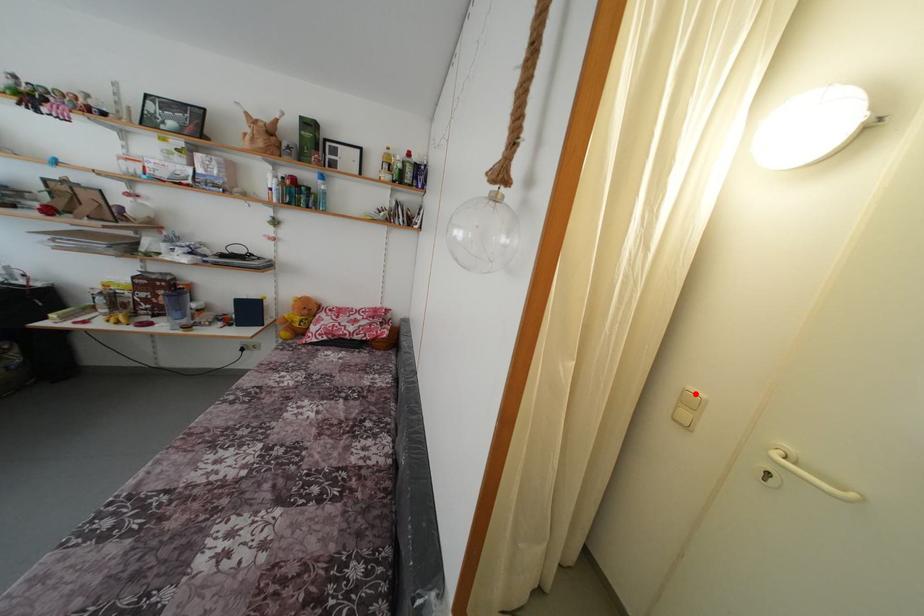
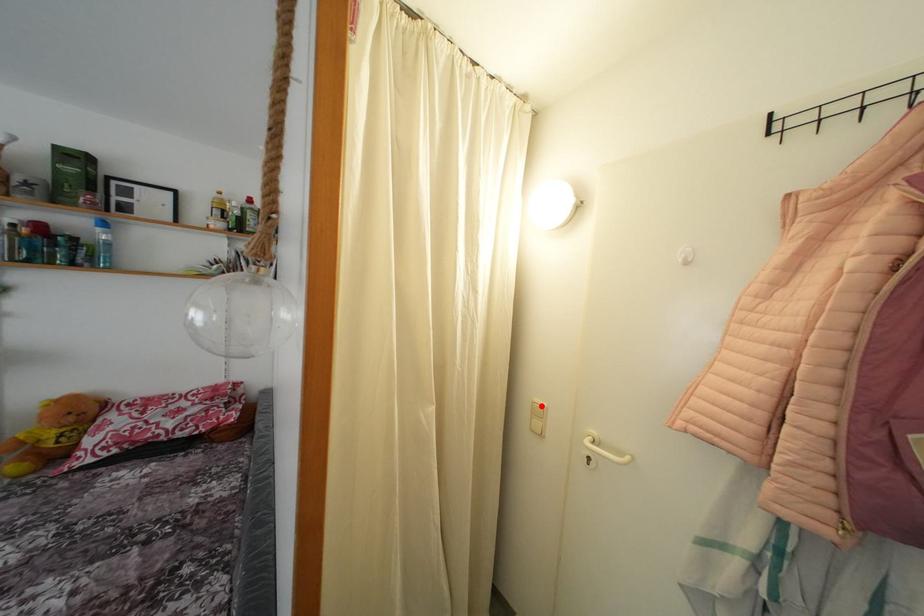
I am providing you with two images of the same scene from different viewpoints. A red point is marked on the first image and another point is marked on the second image. Is the red point in image1 aligned with the point shown in image2?

Yes